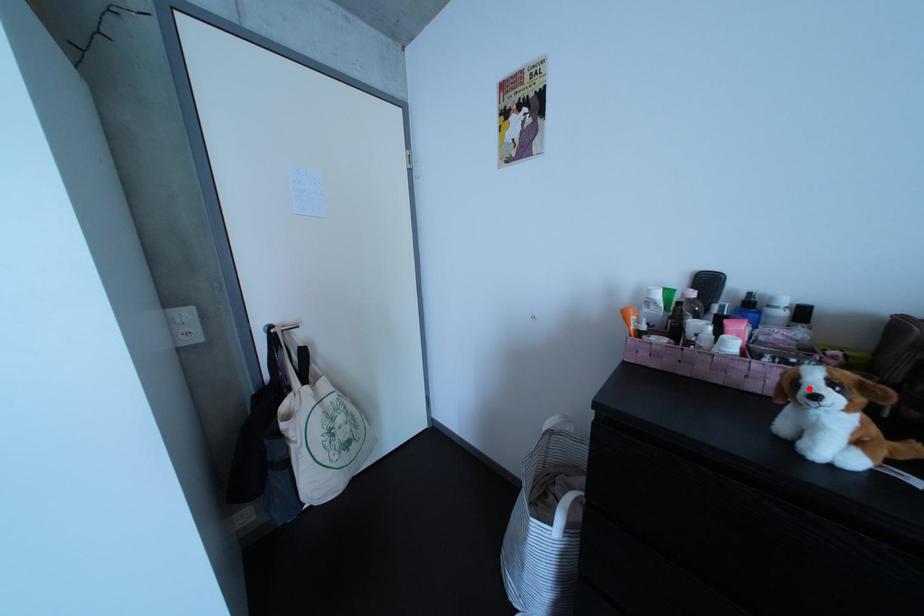
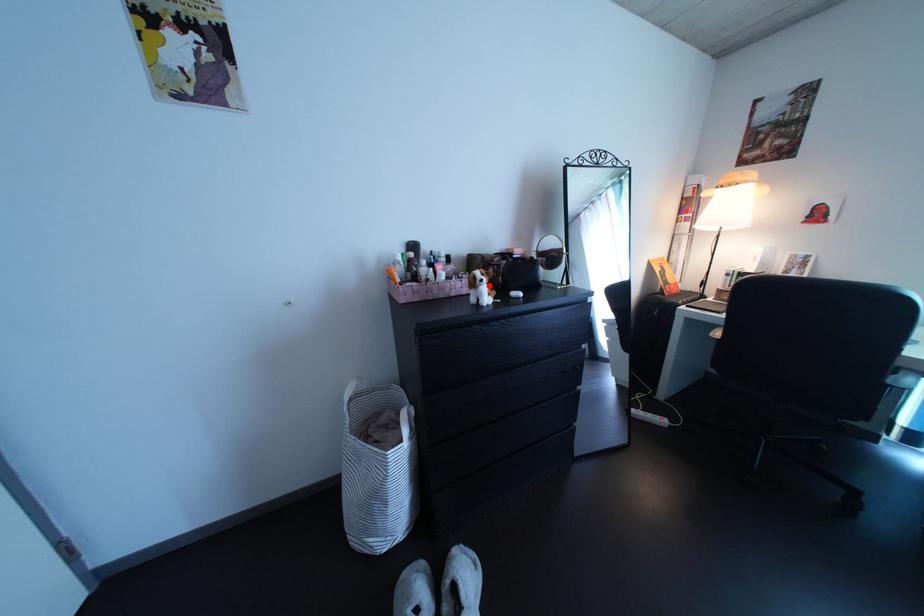
Looking at this image, I am providing you with two images of the same scene from different viewpoints. A red point is marked on the first image and another point is marked on the second image. Is the red point in image1 aligned with the point shown in image2?

Yes